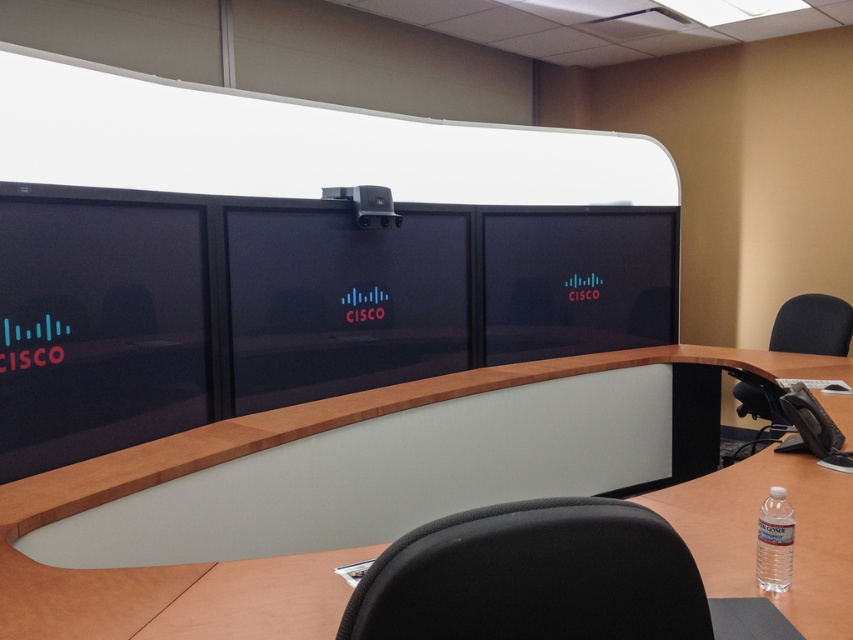
You are standing in the conference room and want to know how far the point at coordinates (x=842, y=544) is from your current position. Can you determine the distance?

The point at coordinates (x=842, y=544) is 1.64 meters away from the camera, so the distance from your current position to the point is approximately 1.64 meters.

You are a guest entering the conference room and need to place a water bottle on the desk. The desk has a black glossy monitor at center and a clear plastic bottle at lower right. Where should you place your bottle to avoid blocking the monitor?

You should place your bottle near the clear plastic bottle at lower right because the black glossy monitor at center is above it, so placing the bottle lower on the desk will avoid blocking the monitor.